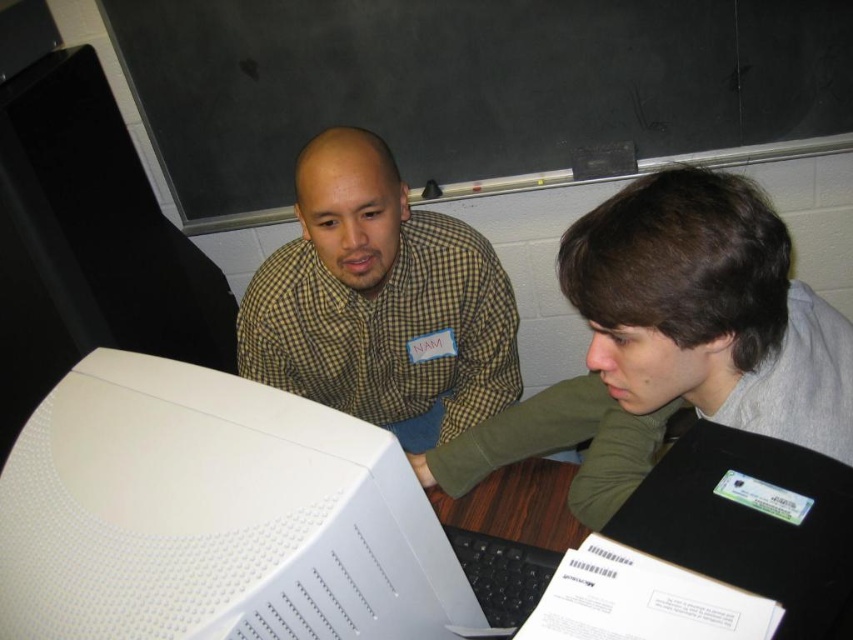
Question: Which of the following is the farthest from the observer?

Choices:
 (A) checkered fabric shirt at upper center
 (B) blackboard at upper center
 (C) white textured monitor at lower left
 (D) gray-green fabric shirt at upper center

Answer: (B)

Question: In this image, where is white textured monitor at lower left located relative to gray-green fabric shirt at upper center?

Choices:
 (A) below
 (B) above

Answer: (A)

Question: Which object is farther from the camera taking this photo?

Choices:
 (A) checkered fabric shirt at upper center
 (B) blackboard at upper center
 (C) white textured monitor at lower left

Answer: (B)

Question: Which object is the farthest from the blackboard at upper center?

Choices:
 (A) checkered fabric shirt at upper center
 (B) gray-green fabric shirt at upper center

Answer: (B)

Question: Can you confirm if white textured monitor at lower left is thinner than gray-green fabric shirt at upper center?

Choices:
 (A) yes
 (B) no

Answer: (A)

Question: Does white textured monitor at lower left have a smaller size compared to gray-green fabric shirt at upper center?

Choices:
 (A) no
 (B) yes

Answer: (B)